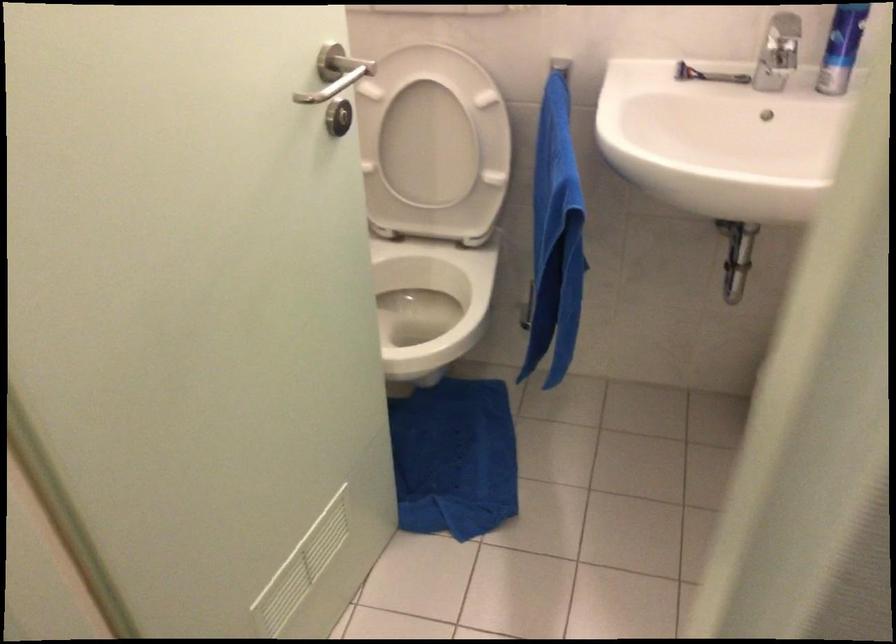
Identify the location of faucet handle. (782, 62).